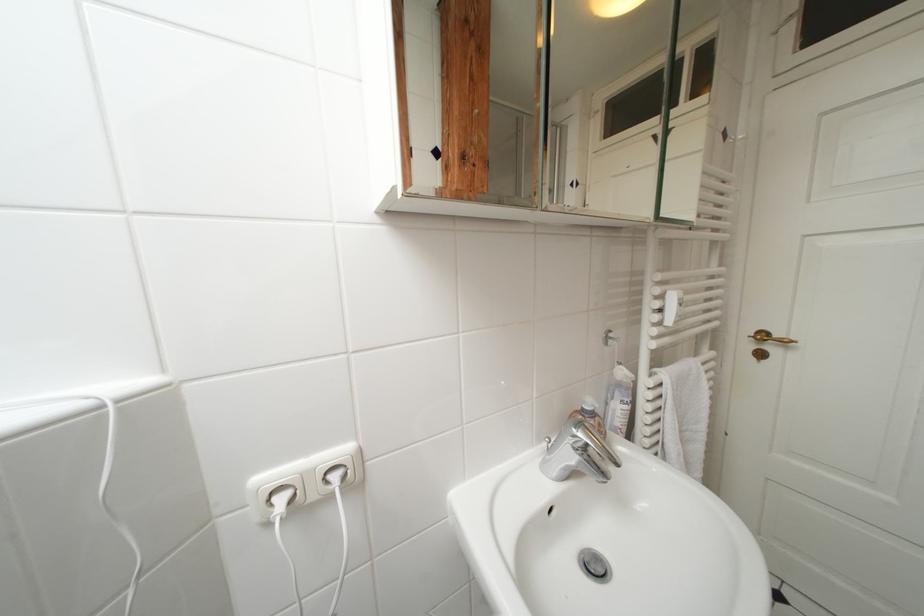
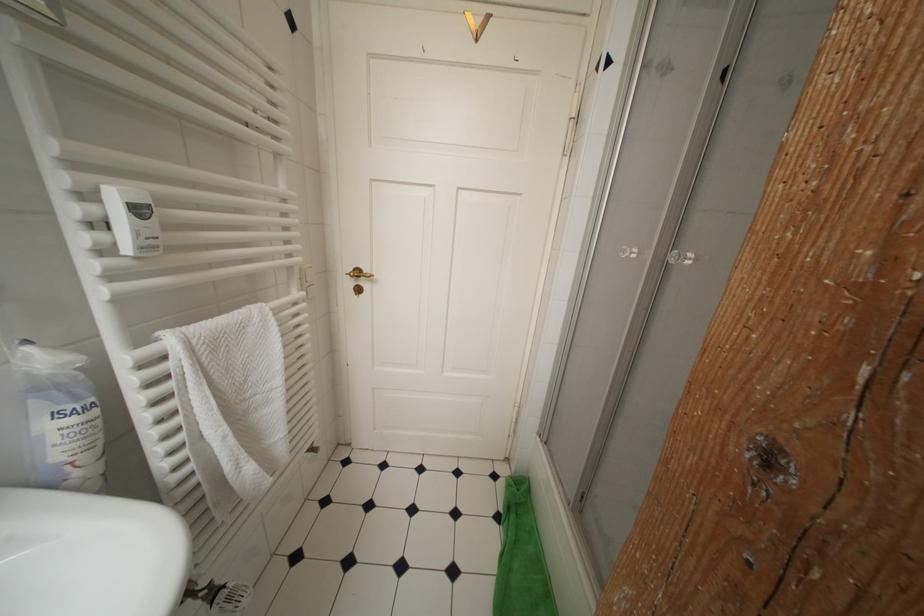
Question: The camera is either moving clockwise (left) or counter-clockwise (right) around the object. The first image is from the beginning of the video and the second image is from the end. Is the camera moving left or right when shooting the video?

Choices:
 (A) Left
 (B) Right

Answer: (A)